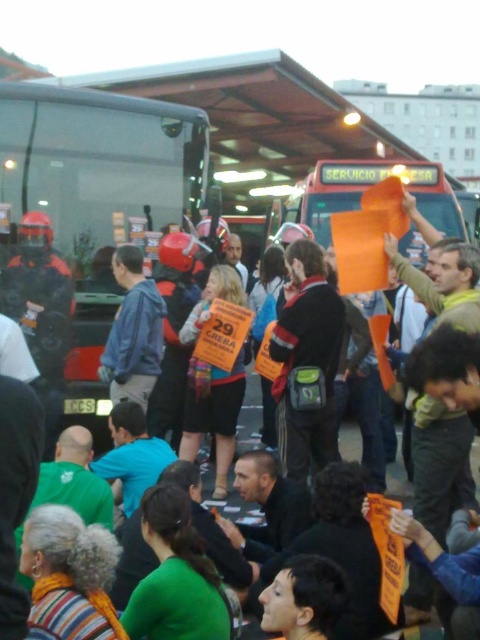
Is transparent glass bus at left below dark gray fabric jacket at center?

No.

Is transparent glass bus at left positioned behind dark gray fabric jacket at center?

Yes, it is behind dark gray fabric jacket at center.

This screenshot has width=480, height=640. Describe the element at coordinates (87, 218) in the screenshot. I see `transparent glass bus at left` at that location.

Locate an element on the screen. This screenshot has width=480, height=640. transparent glass bus at left is located at coordinates (87, 218).